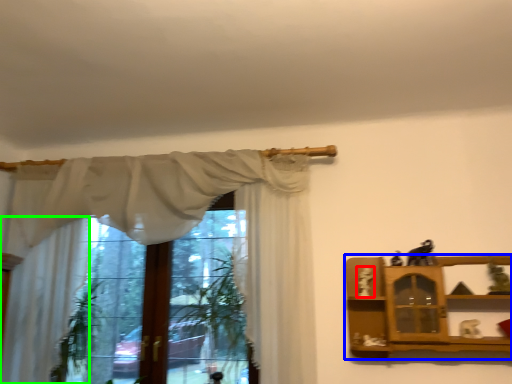
Question: Based on their relative distances, which object is farther from toy (highlighted by a red box)? Choose from shelf (highlighted by a blue box) and curtain (highlighted by a green box).

Choices:
 (A) shelf
 (B) curtain

Answer: (B)